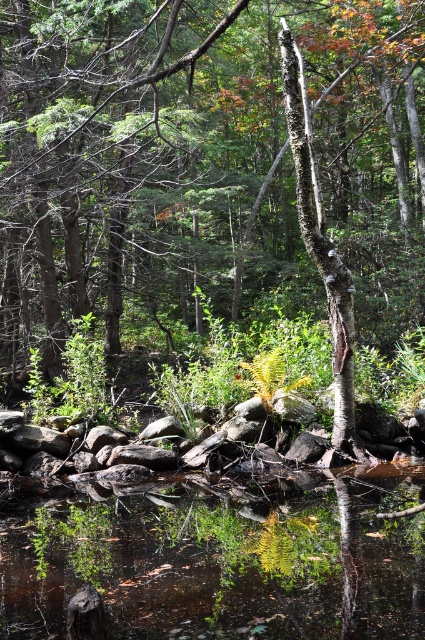
Who is positioned more to the right, smooth bark tree at center or clear water at center?

Positioned to the right is clear water at center.

Is point (53, 76) less distant than point (172, 515)?

That is False.

Is point (363, 45) positioned after point (380, 627)?

Yes, point (363, 45) is farther from viewer.

You are a GUI agent. You are given a task and a screenshot of the screen. Output one action in this format:
    pyautogui.click(x=<x>, y=<y>)
    Task: Click on the smooth bark tree at center
    This screenshot has height=640, width=425.
    Given the screenshot: What is the action you would take?
    pyautogui.click(x=197, y=157)